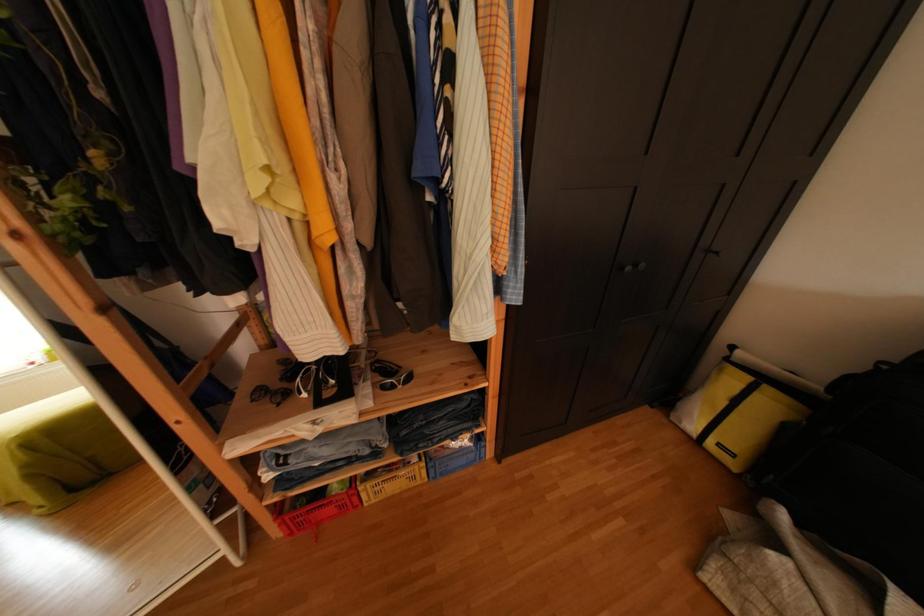
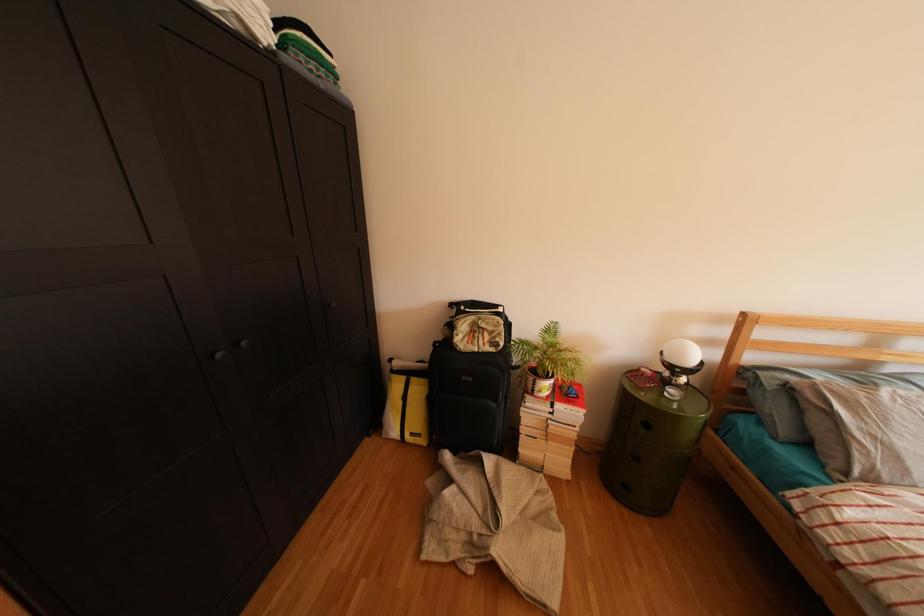
Question: The first image is from the beginning of the video and the second image is from the end. How did the camera likely rotate when shooting the video?

Choices:
 (A) Left
 (B) Right
 (C) Up
 (D) Down

Answer: (B)